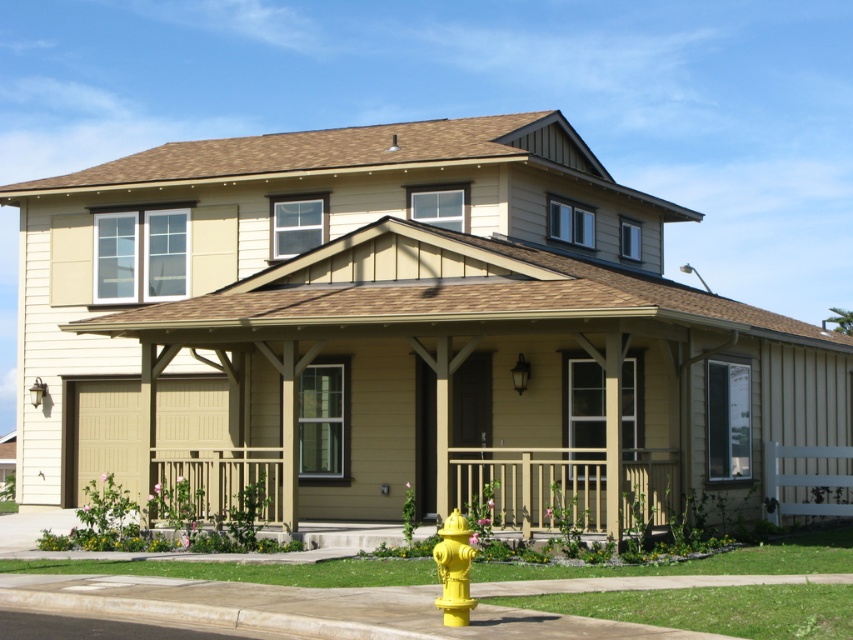
Question: Considering the relative positions of wooden railing at center and yellow matte hydrant at lower center in the image provided, where is wooden railing at center located with respect to yellow matte hydrant at lower center?

Choices:
 (A) left
 (B) right

Answer: (B)

Question: Which object is positioned farthest from the yellow plastic curb at lower center?

Choices:
 (A) wooden railing at center
 (B) yellow matte hydrant at lower center

Answer: (A)

Question: Which point is closer to the camera?

Choices:
 (A) yellow plastic curb at lower center
 (B) yellow matte hydrant at lower center
 (C) wooden railing at center

Answer: (A)

Question: Does yellow plastic curb at lower center come behind yellow matte hydrant at lower center?

Choices:
 (A) no
 (B) yes

Answer: (A)

Question: Which of the following is the farthest from the observer?

Choices:
 (A) yellow plastic curb at lower center
 (B) yellow matte hydrant at lower center

Answer: (B)

Question: From the image, what is the correct spatial relationship of yellow plastic curb at lower center in relation to wooden railing at center?

Choices:
 (A) right
 (B) left

Answer: (B)